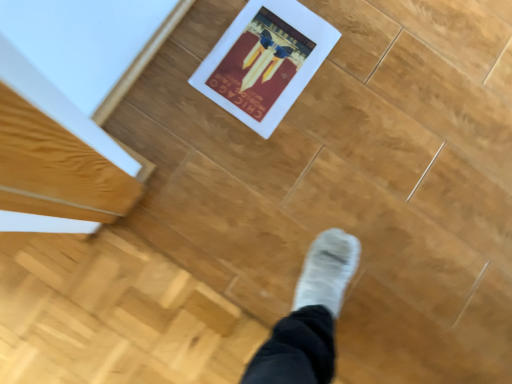
The height and width of the screenshot is (384, 512). Describe the element at coordinates (264, 62) in the screenshot. I see `white matte picture frame at center` at that location.

Identify the location of white matte picture frame at center. (264, 62).

I want to click on white matte picture frame at center, so click(264, 62).